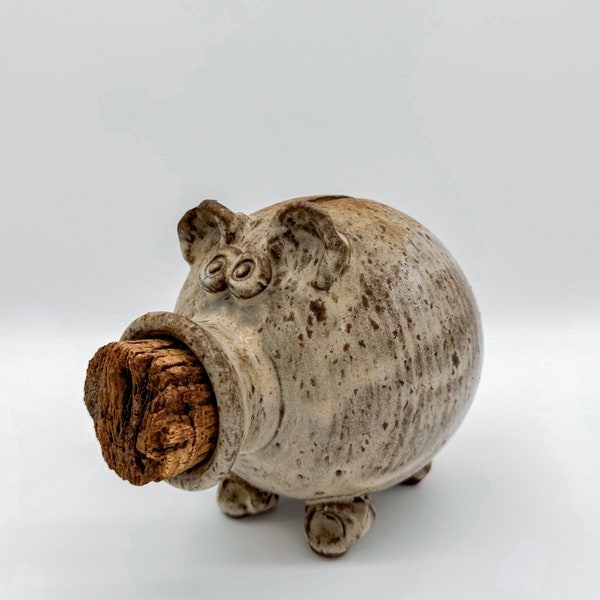
In order to click on cork in this screenshot , I will do `click(139, 410)`.